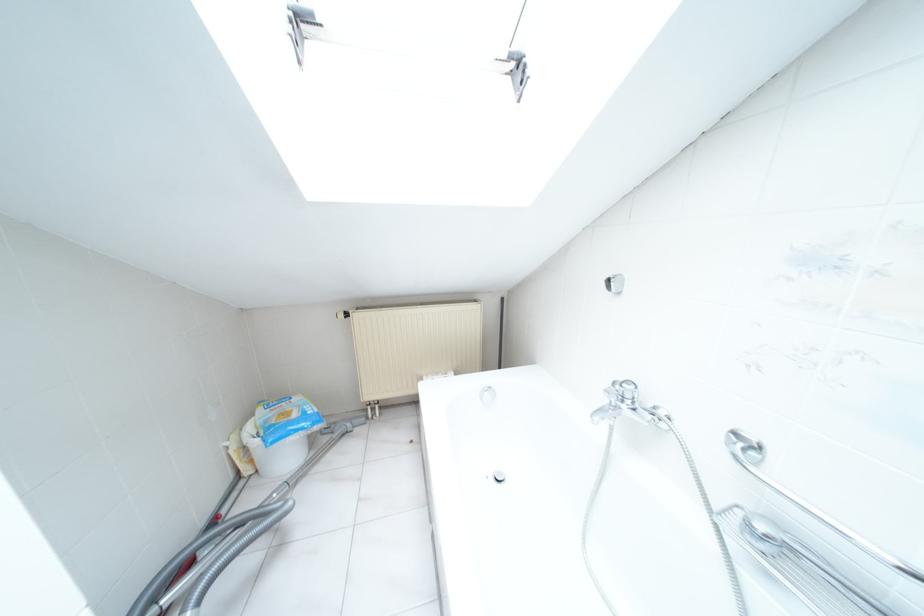
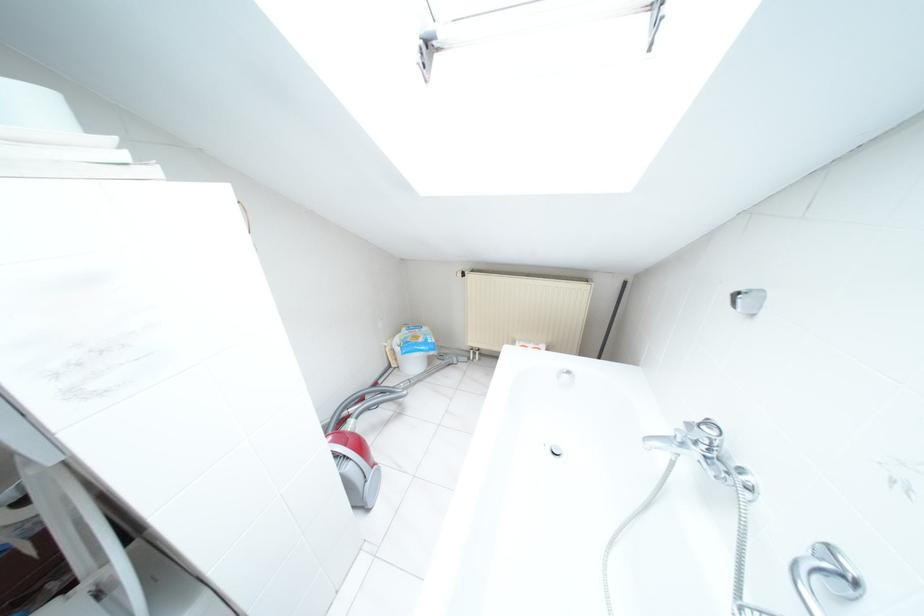
Where in the second image is the point corresponding to pixel 341 315 from the first image?

(458, 274)